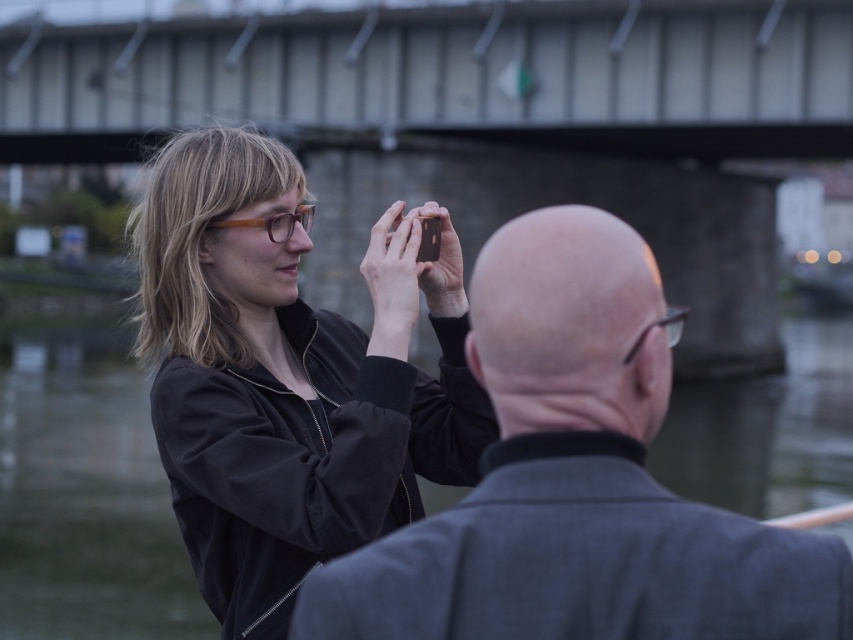
Does matte black jacket at center appear on the left side of brown translucent glasses at upper center?

In fact, matte black jacket at center is to the right of brown translucent glasses at upper center.

Identify the location of matte black jacket at center. Image resolution: width=853 pixels, height=640 pixels. (286, 380).

Can you confirm if concrete bridge at upper center is wider than transparent plastic glasses at upper center?

Indeed, concrete bridge at upper center has a greater width compared to transparent plastic glasses at upper center.

This screenshot has width=853, height=640. In order to click on concrete bridge at upper center in this screenshot , I will do point(434,74).

Who is more forward, (807, 17) or (637, 337)?

Positioned in front is point (637, 337).

I want to click on concrete bridge at upper center, so click(434, 74).

Who is lower down, concrete bridge at upper center or dark gray wool coat at center?

dark gray wool coat at center

Is concrete bridge at upper center wider than dark gray wool coat at center?

Indeed, concrete bridge at upper center has a greater width compared to dark gray wool coat at center.

Is point (68, 61) positioned in front of point (572, 452)?

No, (68, 61) is further to viewer.

The image size is (853, 640). What are the coordinates of `concrete bridge at upper center` in the screenshot? It's located at (434, 74).